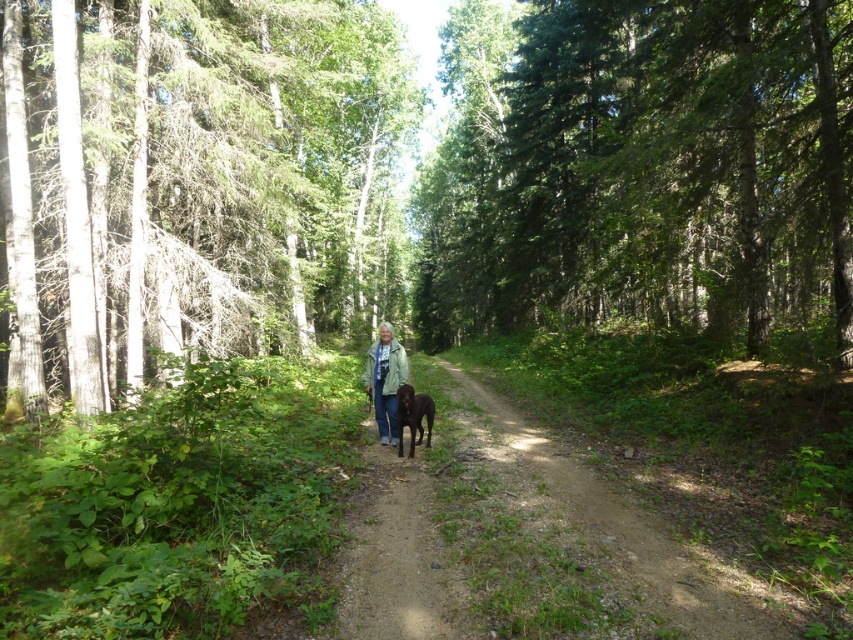
Question: Among these points, which one is farthest from the camera?

Choices:
 (A) (399, 401)
 (B) (383, 396)
 (C) (483, 116)

Answer: (C)

Question: Does green leafy tree at center have a greater width compared to green textured jacket at center?

Choices:
 (A) no
 (B) yes

Answer: (B)

Question: Can you confirm if green leafy tree at center is bigger than green textured jacket at center?

Choices:
 (A) yes
 (B) no

Answer: (A)

Question: Among these objects, which one is farthest from the camera?

Choices:
 (A) green leafy tree at center
 (B) green textured jacket at center

Answer: (B)

Question: Where is smooth bark tree at center located in relation to green leafy tree at center in the image?

Choices:
 (A) left
 (B) right

Answer: (A)

Question: Which object is closer to the camera taking this photo?

Choices:
 (A) green textured jacket at center
 (B) green leafy tree at center
 (C) shiny brown fur at center

Answer: (B)